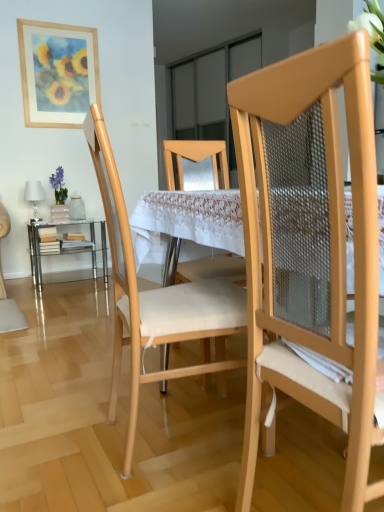
Question: Can you confirm if white lace tablecloth at center, which is counted as the first table, starting from the right, is smaller than clear glass table at lower left, the 2th table positioned from the right?

Choices:
 (A) no
 (B) yes

Answer: (A)

Question: From a real-world perspective, is white lace tablecloth at center, the second table when ordered from left to right, on clear glass table at lower left, acting as the second table starting from the front?

Choices:
 (A) no
 (B) yes

Answer: (B)

Question: Considering the relative sizes of white lace tablecloth at center, which is counted as the first table, starting from the right, and clear glass table at lower left, acting as the second table starting from the front, in the image provided, is white lace tablecloth at center, which is counted as the first table, starting from the right, thinner than clear glass table at lower left, acting as the second table starting from the front,?

Choices:
 (A) yes
 (B) no

Answer: (B)

Question: Is white lace tablecloth at center, which is counted as the first table, starting from the right, at the right side of clear glass table at lower left, the 2th table positioned from the right?

Choices:
 (A) no
 (B) yes

Answer: (B)

Question: Is clear glass table at lower left, acting as the 1th table starting from the left, at the back of white lace tablecloth at center, which is the 1th table in front-to-back order?

Choices:
 (A) yes
 (B) no

Answer: (B)

Question: Does white lace tablecloth at center, the second table when ordered from left to right, come in front of clear glass table at lower left, acting as the second table starting from the front?

Choices:
 (A) yes
 (B) no

Answer: (A)

Question: Is clear glass table at lower left, which is the 1th table from back to front, smaller than matte wood chair at right, the second chair when ordered from back to front?

Choices:
 (A) yes
 (B) no

Answer: (A)

Question: Is clear glass table at lower left, which is the 1th table from back to front, far away from matte wood chair at right, the second chair when ordered from back to front?

Choices:
 (A) yes
 (B) no

Answer: (A)

Question: Is clear glass table at lower left, the 2th table positioned from the right, touching matte wood chair at right, the second chair when ordered from back to front?

Choices:
 (A) yes
 (B) no

Answer: (B)

Question: Is clear glass table at lower left, acting as the second table starting from the front, positioned behind matte wood chair at right, the second chair when ordered from back to front?

Choices:
 (A) no
 (B) yes

Answer: (B)

Question: Does clear glass table at lower left, the 2th table positioned from the right, appear on the left side of matte wood chair at right, the second chair when ordered from back to front?

Choices:
 (A) no
 (B) yes

Answer: (B)

Question: Does clear glass table at lower left, acting as the second table starting from the front, have a lesser height compared to matte wood chair at right, the second chair when ordered from back to front?

Choices:
 (A) no
 (B) yes

Answer: (B)

Question: Is clear glass table at lower left, the 2th table positioned from the right, further to the viewer compared to natural wood chair at center, marked as the second chair in a front-to-back arrangement?

Choices:
 (A) no
 (B) yes

Answer: (B)